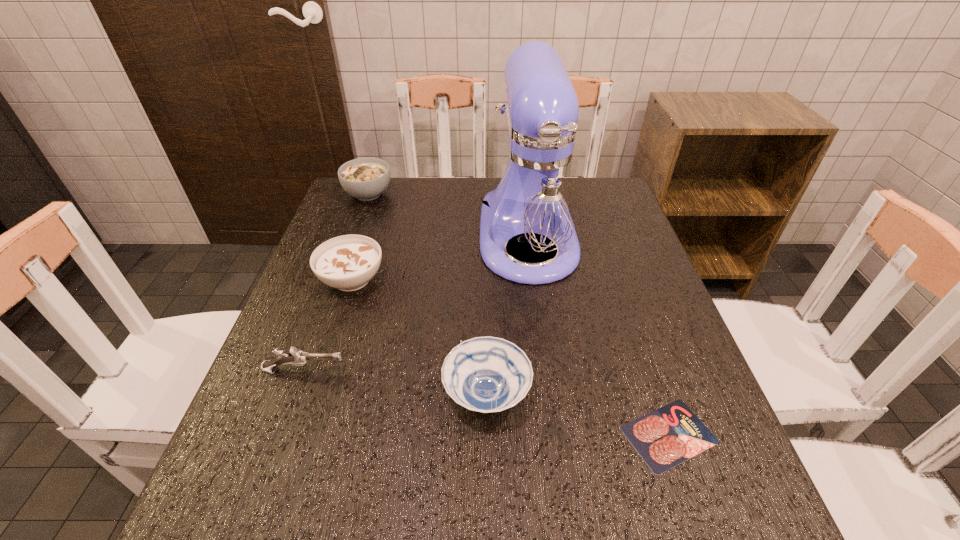
This screenshot has width=960, height=540. Identify the location of free space between the farthest soup bowl and the tallest object. (448, 215).

Locate an element on the screen. blank region between the salami and the tallest object is located at coordinates (598, 336).

Where is `free area in between the gun and the tallest object`? free area in between the gun and the tallest object is located at coordinates (417, 303).

Where is `unoccupied area between the nearest soup bowl and the gun`? The width and height of the screenshot is (960, 540). unoccupied area between the nearest soup bowl and the gun is located at coordinates (396, 383).

I want to click on object that stands as the closest to the gun, so click(348, 262).

I want to click on object that is the second nearest to the gun, so click(487, 374).

Where is `soup bowl that is the second closest to the second farthest soup bowl`? soup bowl that is the second closest to the second farthest soup bowl is located at coordinates (366, 179).

At what (x,y) coordinates should I click in order to perform the action: click on soup bowl that is the second closest to the gun. Please return your answer as a coordinate pair (x, y). The height and width of the screenshot is (540, 960). Looking at the image, I should click on (487, 374).

Identify the location of vacant space that satisfies the following two spatial constraints: 1. at the mixing area of the mixer; 2. aimed along the barrel of the gun. Image resolution: width=960 pixels, height=540 pixels. (546, 370).

This screenshot has height=540, width=960. Identify the location of vacant point that satisfies the following two spatial constraints: 1. on the front side of the second nearest soup bowl; 2. on the left side of the nearest soup bowl. (315, 395).